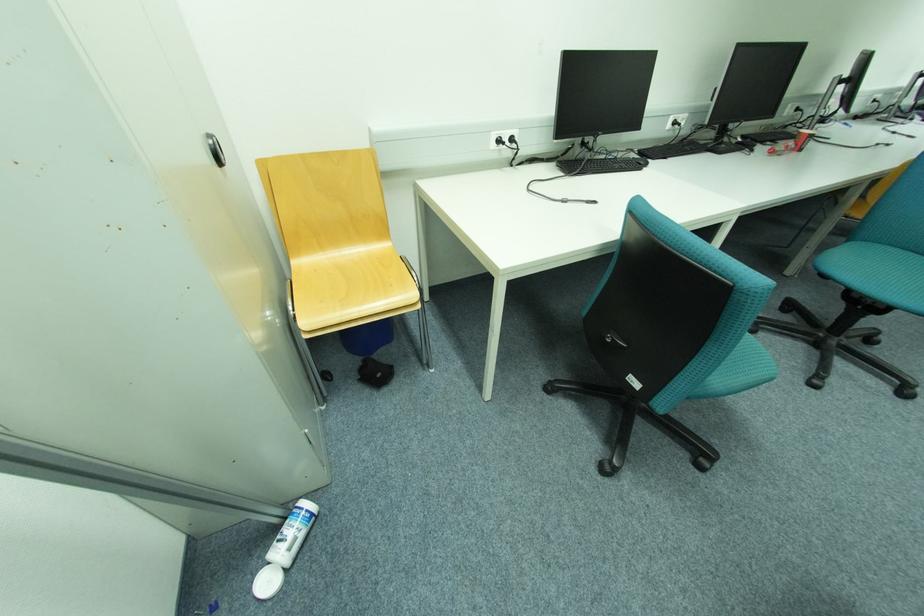
Where is `white plastic bottle`? The height and width of the screenshot is (616, 924). white plastic bottle is located at coordinates (293, 533).